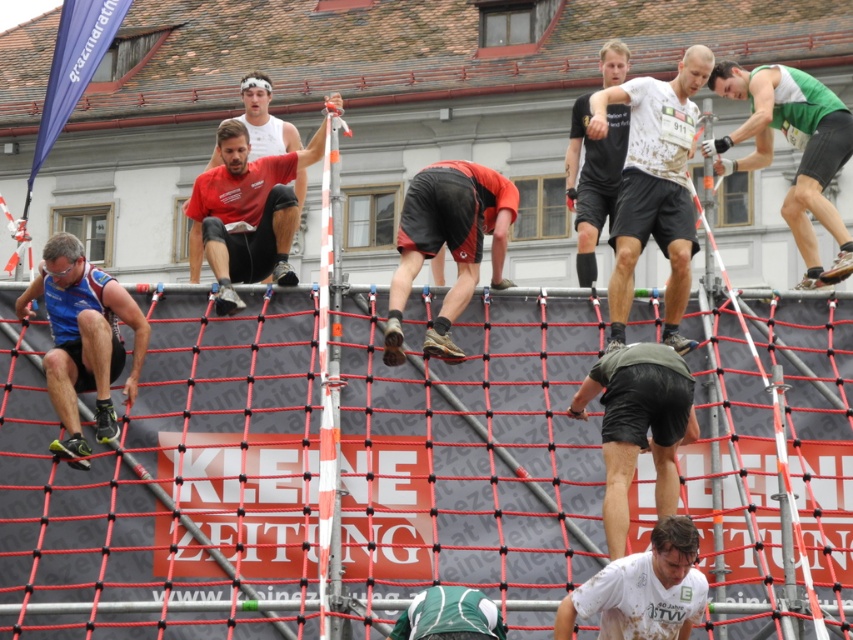
Question: Can you confirm if matte red shirt at upper center is positioned to the left of black matte shorts at upper center?

Choices:
 (A) no
 (B) yes

Answer: (B)

Question: Can you confirm if white matte shirt at upper center is wider than green matte tank top at upper right?

Choices:
 (A) no
 (B) yes

Answer: (A)

Question: Which point is farther to the camera?

Choices:
 (A) matte red shirt at upper center
 (B) green matte shorts at center

Answer: (A)

Question: Considering the real-world distances, which object is farthest from the black matte shorts at upper center?

Choices:
 (A) green matte tank top at upper right
 (B) blue matte vest at left
 (C) orange fabric shorts at center

Answer: (B)

Question: Is blue matte vest at left below green jersey at lower center?

Choices:
 (A) yes
 (B) no

Answer: (B)

Question: Which object is farther from the camera taking this photo?

Choices:
 (A) orange fabric shorts at center
 (B) white matte shirt at upper center
 (C) black matte shorts at upper center

Answer: (C)